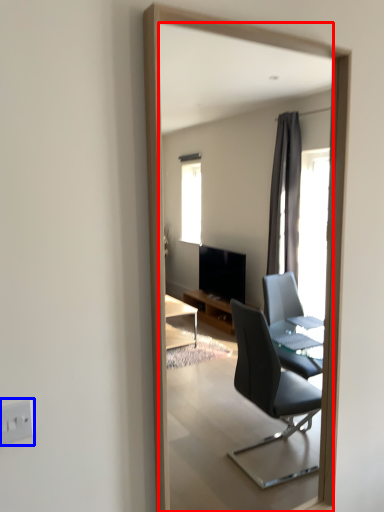
Question: Which object is further to the camera taking this photo, mirror (highlighted by a red box) or electric outlet (highlighted by a blue box)?

Choices:
 (A) mirror
 (B) electric outlet

Answer: (A)